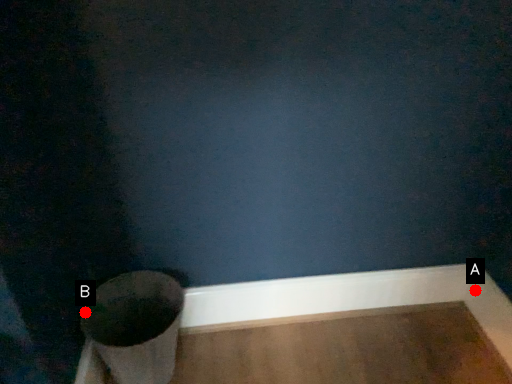
Question: Two points are circled on the image, labeled by A and B beside each circle. Which point is farther to the camera?

Choices:
 (A) A is further
 (B) B is further

Answer: (A)